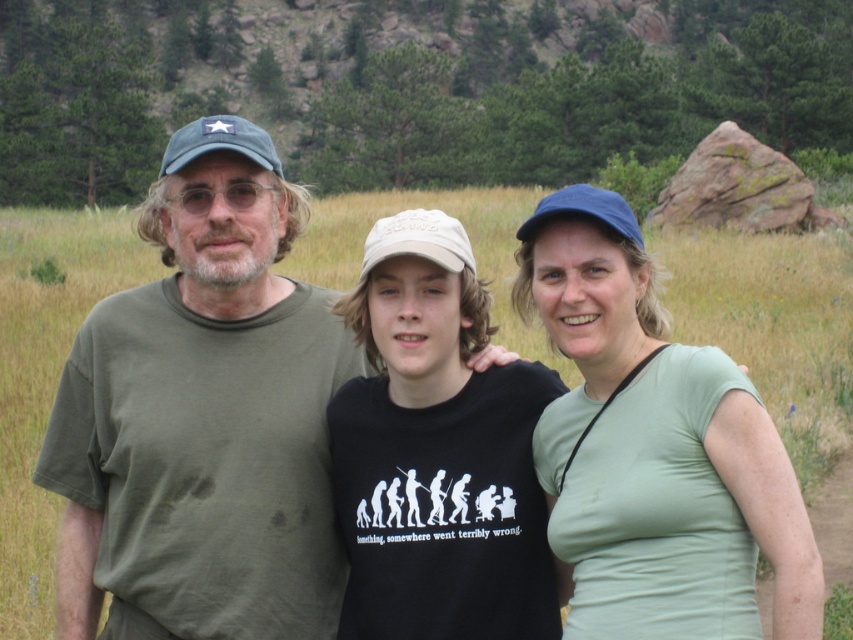
Is point (109, 497) positioned behind point (799, 497)?

That is True.

This screenshot has height=640, width=853. I want to click on green cotton t-shirt at left, so click(202, 417).

The image size is (853, 640). What are the coordinates of `green cotton t-shirt at left` in the screenshot? It's located at pyautogui.click(x=202, y=417).